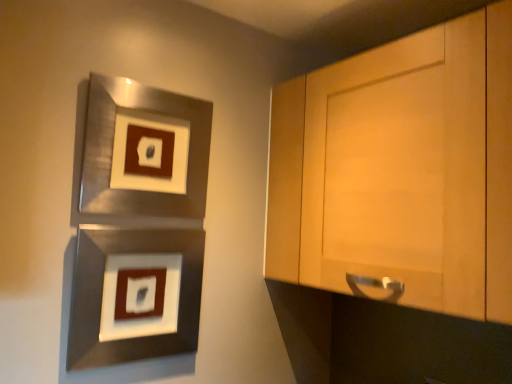
Question: Does metallic silver picture frame at upper left, acting as the second picture frame starting from the bottom, come in front of metallic silver picture frame at lower left, arranged as the 1th picture frame when ordered from the bottom?

Choices:
 (A) yes
 (B) no

Answer: (B)

Question: Are metallic silver picture frame at upper left, acting as the second picture frame starting from the bottom, and metallic silver picture frame at lower left, arranged as the 1th picture frame when ordered from the bottom, beside each other?

Choices:
 (A) no
 (B) yes

Answer: (A)

Question: Does metallic silver picture frame at upper left, acting as the second picture frame starting from the bottom, appear on the left side of metallic silver picture frame at lower left, arranged as the second picture frame when viewed from the top?

Choices:
 (A) yes
 (B) no

Answer: (B)

Question: From a real-world perspective, does metallic silver picture frame at upper left, positioned as the first picture frame in top-to-bottom order, sit lower than metallic silver picture frame at lower left, arranged as the second picture frame when viewed from the top?

Choices:
 (A) yes
 (B) no

Answer: (B)

Question: Does metallic silver picture frame at upper left, positioned as the first picture frame in top-to-bottom order, appear on the right side of metallic silver picture frame at lower left, arranged as the second picture frame when viewed from the top?

Choices:
 (A) yes
 (B) no

Answer: (A)

Question: Considering the relative sizes of metallic silver picture frame at upper left, acting as the second picture frame starting from the bottom, and metallic silver picture frame at lower left, arranged as the second picture frame when viewed from the top, in the image provided, is metallic silver picture frame at upper left, acting as the second picture frame starting from the bottom, taller than metallic silver picture frame at lower left, arranged as the second picture frame when viewed from the top,?

Choices:
 (A) no
 (B) yes

Answer: (B)

Question: From the image's perspective, is metallic silver picture frame at lower left, arranged as the 1th picture frame when ordered from the bottom, located above metallic silver picture frame at upper left, acting as the second picture frame starting from the bottom?

Choices:
 (A) no
 (B) yes

Answer: (A)

Question: From the image's perspective, does metallic silver picture frame at lower left, arranged as the 1th picture frame when ordered from the bottom, appear lower than metallic silver picture frame at upper left, positioned as the first picture frame in top-to-bottom order?

Choices:
 (A) yes
 (B) no

Answer: (A)

Question: Would you say metallic silver picture frame at upper left, acting as the second picture frame starting from the bottom, is part of metallic silver picture frame at lower left, arranged as the second picture frame when viewed from the top,'s contents?

Choices:
 (A) no
 (B) yes

Answer: (A)

Question: Is metallic silver picture frame at lower left, arranged as the 1th picture frame when ordered from the bottom, positioned with its back to metallic silver picture frame at upper left, positioned as the first picture frame in top-to-bottom order?

Choices:
 (A) yes
 (B) no

Answer: (B)

Question: Considering the relative sizes of metallic silver picture frame at lower left, arranged as the 1th picture frame when ordered from the bottom, and metallic silver picture frame at upper left, acting as the second picture frame starting from the bottom, in the image provided, is metallic silver picture frame at lower left, arranged as the 1th picture frame when ordered from the bottom, smaller than metallic silver picture frame at upper left, acting as the second picture frame starting from the bottom,?

Choices:
 (A) no
 (B) yes

Answer: (B)

Question: Is metallic silver picture frame at lower left, arranged as the second picture frame when viewed from the top, positioned beyond the bounds of metallic silver picture frame at upper left, acting as the second picture frame starting from the bottom?

Choices:
 (A) yes
 (B) no

Answer: (A)

Question: Would you say metallic silver picture frame at lower left, arranged as the second picture frame when viewed from the top, is inside or outside metallic silver picture frame at upper left, acting as the second picture frame starting from the bottom?

Choices:
 (A) inside
 (B) outside

Answer: (B)